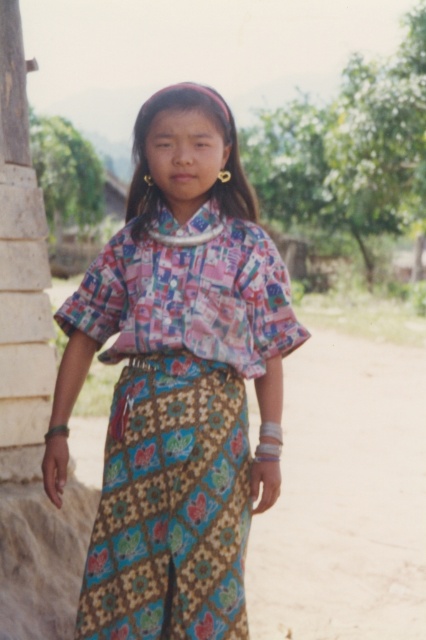
You are a photographer trying to capture the girl in the scene. If you focus on the printed fabric blouse at center, will the brown dirt field at lower center be in focus as well?

The printed fabric blouse at center is closer to the viewer than the brown dirt field at lower center. Since the blouse is in focus, the field will be out of focus due to the depth of field.

You are taking a photo of the girl and want to focus on two points in the image. The first point is at coordinates point (x=230, y=548) and the second is at point (x=408, y=518). Which point should you focus on first if you want to ensure the girl is in sharp focus?

You should focus on point (x=230, y=548) first because it is closer to the camera than point (x=408, y=518), ensuring the girl is in sharp focus.